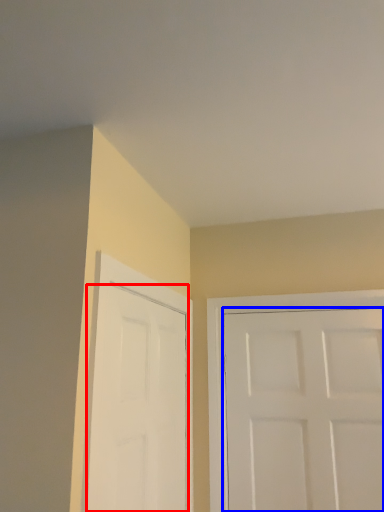
Question: Which object appears farthest to the camera in this image, door (highlighted by a red box) or door (highlighted by a blue box)?

Choices:
 (A) door
 (B) door

Answer: (B)